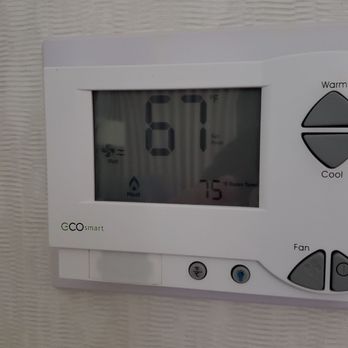
Identify the location of plastic cover. Image resolution: width=348 pixels, height=348 pixels. (274, 227), (154, 267), (163, 72), (72, 137).